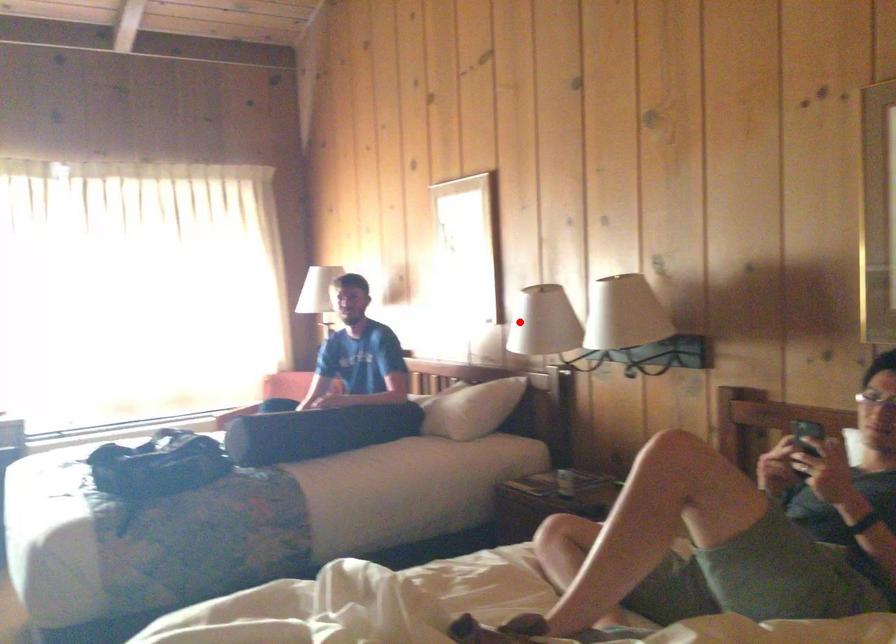
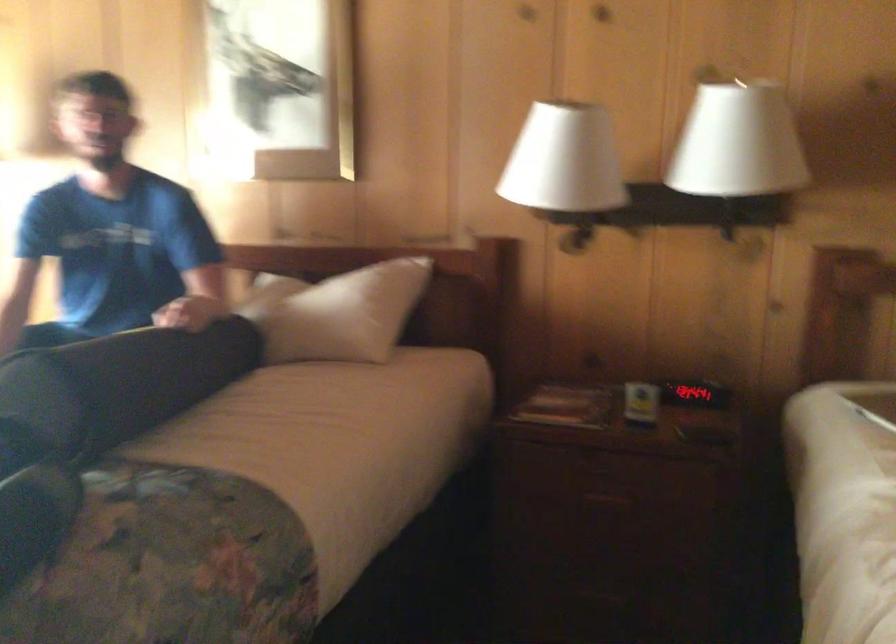
Where in the second image is the point corresponding to the highlighted location from the first image?

(564, 160)